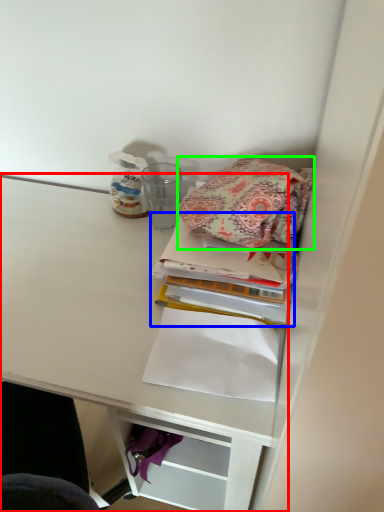
Question: Which object is the farthest from shelf (highlighted by a red box)? Choose among these: book (highlighted by a blue box) or cloth (highlighted by a green box).

Choices:
 (A) book
 (B) cloth

Answer: (B)